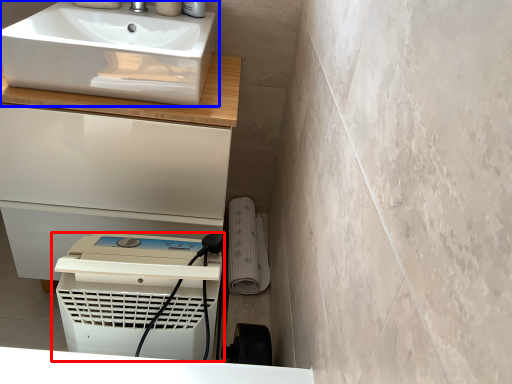
Question: Which point is closer to the camera, home appliance (highlighted by a red box) or sink (highlighted by a blue box)?

Choices:
 (A) home appliance
 (B) sink

Answer: (A)